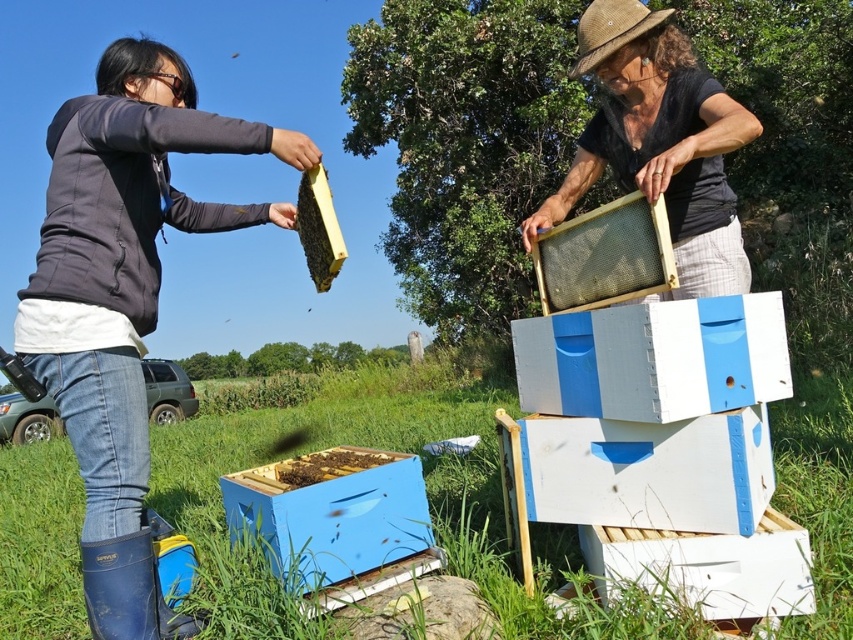
Which is more to the right, matte black jacket at left or black wax comb at upper center?

Positioned to the right is black wax comb at upper center.

Based on the photo, measure the distance between matte black jacket at left and camera.

The distance of matte black jacket at left from camera is 1.86 meters.

Is point (28, 307) behind point (328, 202)?

That is False.

Image resolution: width=853 pixels, height=640 pixels. In order to click on matte black jacket at left in this screenshot , I will do `click(123, 298)`.

Is matte black jacket at left thinner than wooden frame at center?

No, matte black jacket at left is not thinner than wooden frame at center.

Is matte black jacket at left smaller than wooden frame at center?

No, matte black jacket at left is not smaller than wooden frame at center.

Is point (35, 323) closer to camera compared to point (614, 266)?

Yes, point (35, 323) is closer to viewer.

Identify the location of matte black jacket at left. (123, 298).

Does matte black jacket at left appear on the right side of matte black frame at center?

In fact, matte black jacket at left is to the left of matte black frame at center.

Between matte black jacket at left and matte black frame at center, which one appears on the left side from the viewer's perspective?

Positioned to the left is matte black jacket at left.

Where is `matte black jacket at left`? The image size is (853, 640). matte black jacket at left is located at coordinates (123, 298).